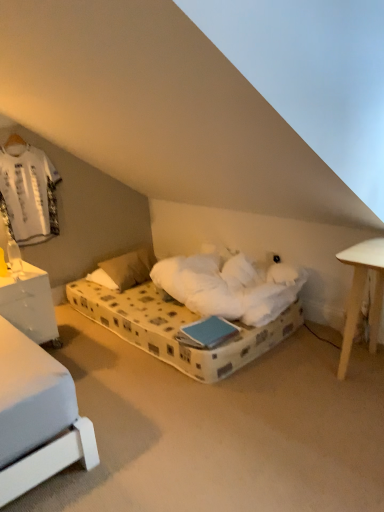
Image resolution: width=384 pixels, height=512 pixels. Describe the element at coordinates (29, 304) in the screenshot. I see `white glossy nightstand at left` at that location.

Measure the distance between point (15, 247) and camera.

3.09 meters.

Locate an element on the screen. Image resolution: width=384 pixels, height=512 pixels. white soft pillow at center is located at coordinates (125, 269).

Does white plastic table lamp at left lie behind white glossy nightstand at left?

Yes, the depth of white plastic table lamp at left is greater than that of white glossy nightstand at left.

In terms of height, does white plastic table lamp at left look taller or shorter compared to white glossy nightstand at left?

Clearly, white plastic table lamp at left is shorter compared to white glossy nightstand at left.

Based on their positions, is white plastic table lamp at left located to the left or right of white glossy nightstand at left?

Clearly, white plastic table lamp at left is on the right of white glossy nightstand at left in the image.

Is white plastic table lamp at left bigger or smaller than white glossy nightstand at left?

white plastic table lamp at left is smaller than white glossy nightstand at left.

Is white soft pillow at center with white glossy nightstand at left?

No, white soft pillow at center is not touching white glossy nightstand at left.

How far apart are white soft pillow at center and white glossy nightstand at left?

A distance of 28.15 inches exists between white soft pillow at center and white glossy nightstand at left.

From the image's perspective, which object appears higher, white soft pillow at center or white glossy nightstand at left?

white soft pillow at center, from the image's perspective.

Is white soft pillow at center aimed at white glossy nightstand at left?

No, white soft pillow at center is not oriented towards white glossy nightstand at left.

From the image's perspective, relative to white soft pillow at center, is white glossy nightstand at left above or below?

Answer: Based on their image positions, white glossy nightstand at left is located beneath white soft pillow at center.

From a real-world perspective, between white glossy nightstand at left and white soft pillow at center, who is vertically lower?

white soft pillow at center, from a real-world perspective.

Can white soft pillow at center be found inside white glossy nightstand at left?

No, white soft pillow at center is not a part of white glossy nightstand at left.

Which of these two, white soft pillow at center or white plastic table lamp at left, is thinner?

white plastic table lamp at left is thinner.

Between point (133, 264) and point (19, 251), which one is positioned in front?

The point (19, 251) is in front.

Who is smaller, white soft pillow at center or white plastic table lamp at left?

white plastic table lamp at left is smaller.

Measure the distance from white glossy nightstand at left to white plastic table lamp at left.

They are 8.43 inches apart.

Is white glossy nightstand at left further to camera compared to white plastic table lamp at left?

That is False.

Is white glossy nightstand at left facing towards white plastic table lamp at left?

No, white glossy nightstand at left is not facing towards white plastic table lamp at left.

Would you say white glossy nightstand at left is to the left or to the right of white plastic table lamp at left in the picture?

Clearly, white glossy nightstand at left is on the left of white plastic table lamp at left in the image.

Based on the photo, is white plastic table lamp at left behind white soft pillow at center?

That is False.

The width and height of the screenshot is (384, 512). Identify the location of table lamp positioned vertically above the white soft pillow at center (from a real-world perspective). (15, 258).

Is white plastic table lamp at left turned away from white soft pillow at center?

No, white plastic table lamp at left is not facing the opposite direction of white soft pillow at center.

Locate an element on the screen. The image size is (384, 512). nightstand below the white plastic table lamp at left (from a real-world perspective) is located at coordinates (29, 304).

Image resolution: width=384 pixels, height=512 pixels. What are the coordinates of `pillow on the right of white glossy nightstand at left` in the screenshot? It's located at (125, 269).

Which object lies further to the anchor point white plastic table lamp at left, white glossy nightstand at left or white soft pillow at center?

white soft pillow at center lies further to white plastic table lamp at left than the other object.

Based on their spatial positions, is white plastic table lamp at left or white glossy nightstand at left closer to white soft pillow at center?

white glossy nightstand at left.

From the image, which object appears to be farther from white glossy nightstand at left, white soft pillow at center or white plastic table lamp at left?

white soft pillow at center is positioned further to the anchor white glossy nightstand at left.

From the image, which object appears to be nearer to white soft pillow at center, white glossy nightstand at left or white plastic table lamp at left?

white glossy nightstand at left.

Based on their spatial positions, is white soft pillow at center or white glossy nightstand at left closer to white plastic table lamp at left?

The object closer to white plastic table lamp at left is white glossy nightstand at left.

Considering their positions, is white plastic table lamp at left positioned further to white glossy nightstand at left than white soft pillow at center?

white soft pillow at center is further to white glossy nightstand at left.

What are the coordinates of `table lamp between white glossy nightstand at left and white soft pillow at center from front to back` in the screenshot? It's located at (15, 258).